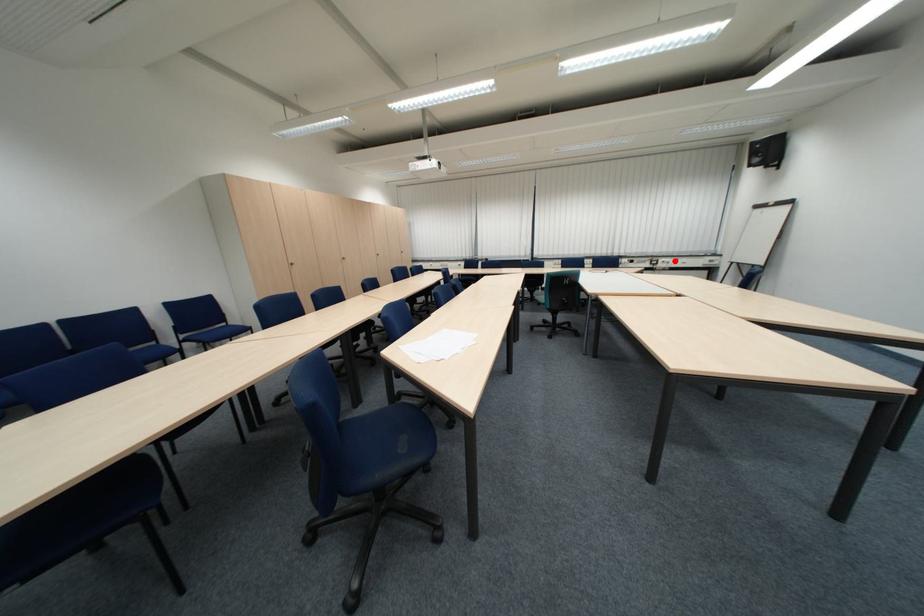
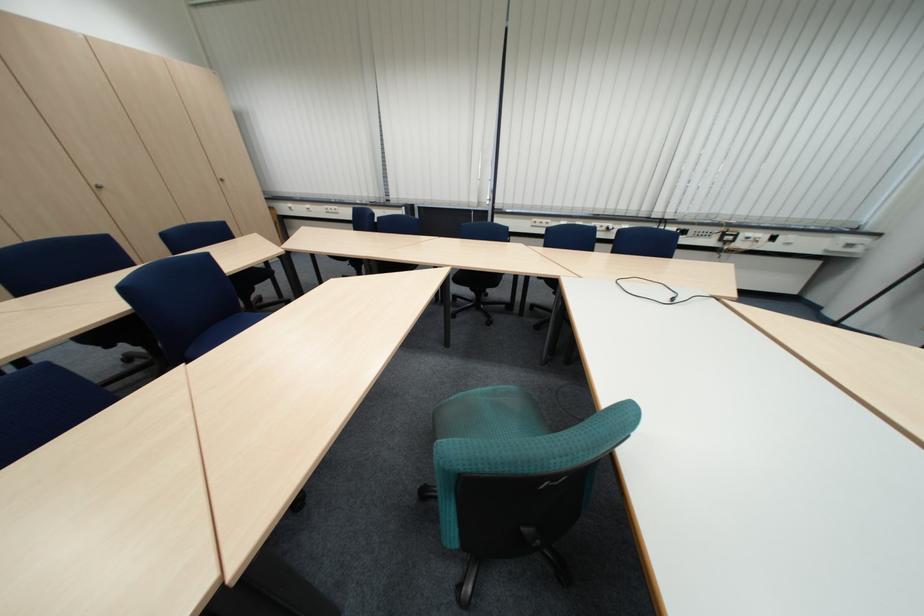
The point at the highlighted location is marked in the first image. Where is the corresponding point in the second image?

(759, 235)